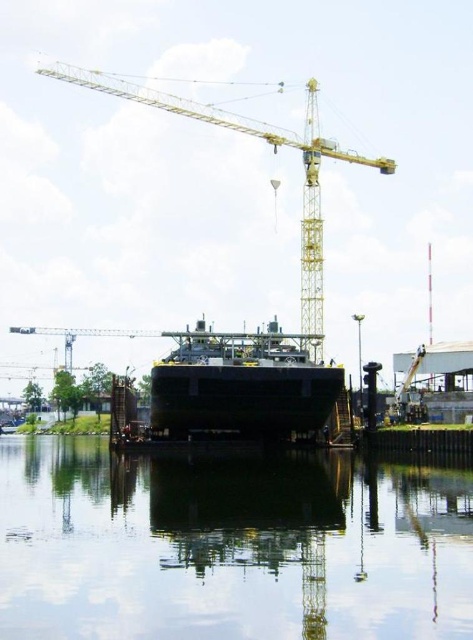
You are a worker standing at the edge of the dry dock. You need to place a heavy tool on the transparent glass water at center. Is this possible?

The transparent glass water at center is located at point [228,547], but since water cannot support heavy tools, placing it there is not possible.

You are a safety inspector checking the dry dock. You need to ensure that the transparent glass water at center does not overflow. Given that the black matte ship at center is currently submerged, which object would you monitor more closely for water level changes?

The transparent glass water at center is shorter than the black matte ship at center, so you should monitor the transparent glass water at center more closely since its level is lower and could potentially rise to overflow.

You are a safety inspector evaluating the dry dock setup. You notice the transparent glass water at center and the yellow metallic crane at upper center. Based on their widths, which one is narrower?

The transparent glass water at center is narrower than the yellow metallic crane at upper center.